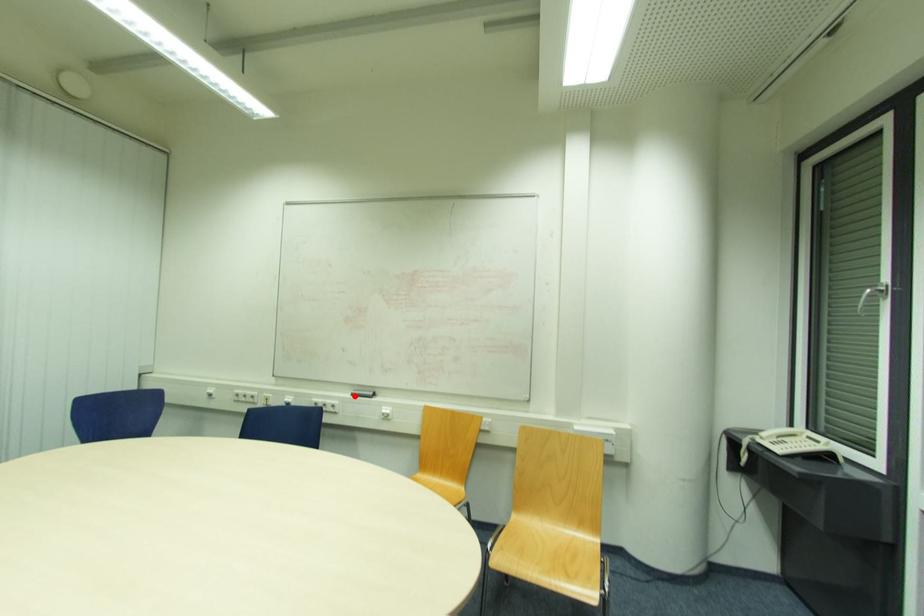
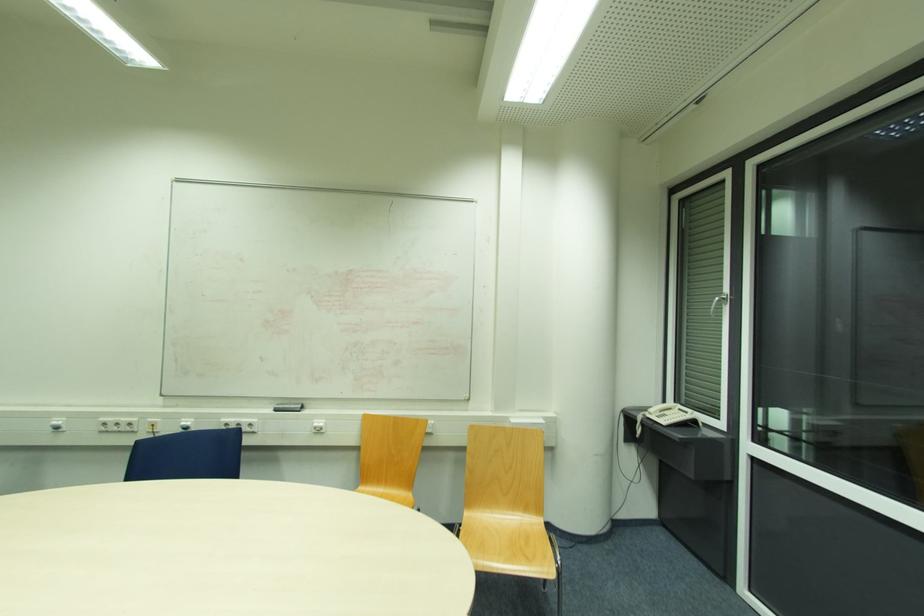
In the second image, find the point that corresponds to the highlighted location in the first image.

(276, 411)